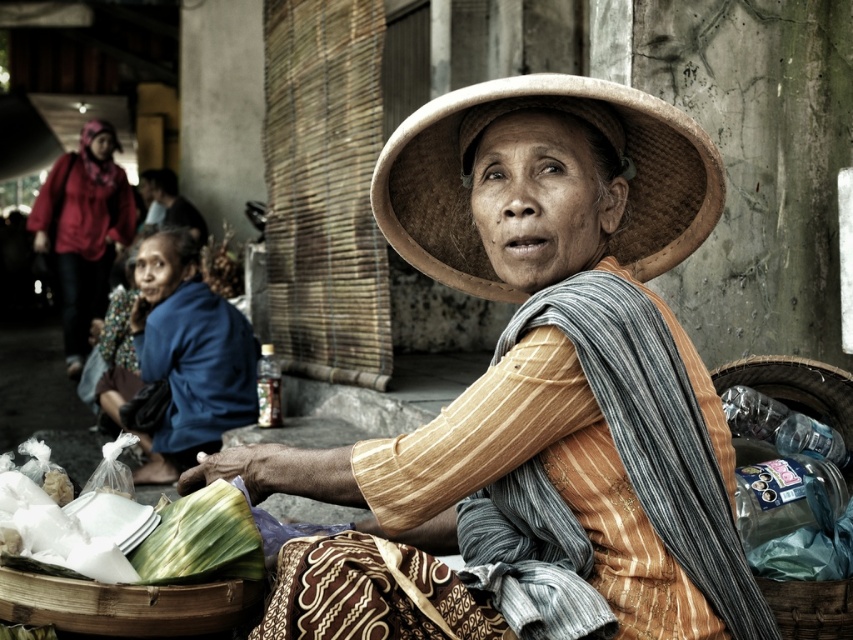
You are a customer at the market and want to buy some vegetables. The vendor has a matte straw hat at center and a blue fabric at lower left. Which item is closer to you?

The matte straw hat at center is closer to you because it is in front of the blue fabric at lower left.